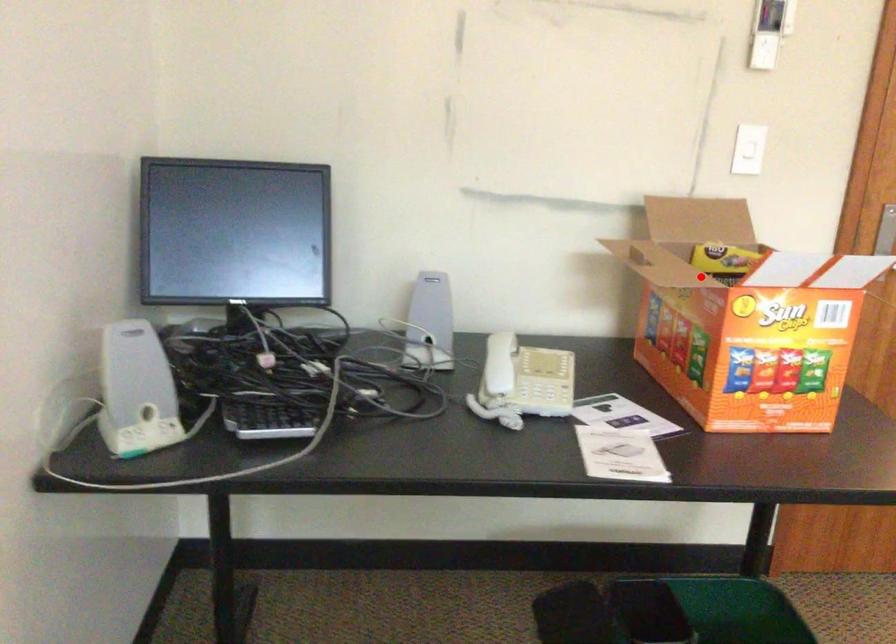
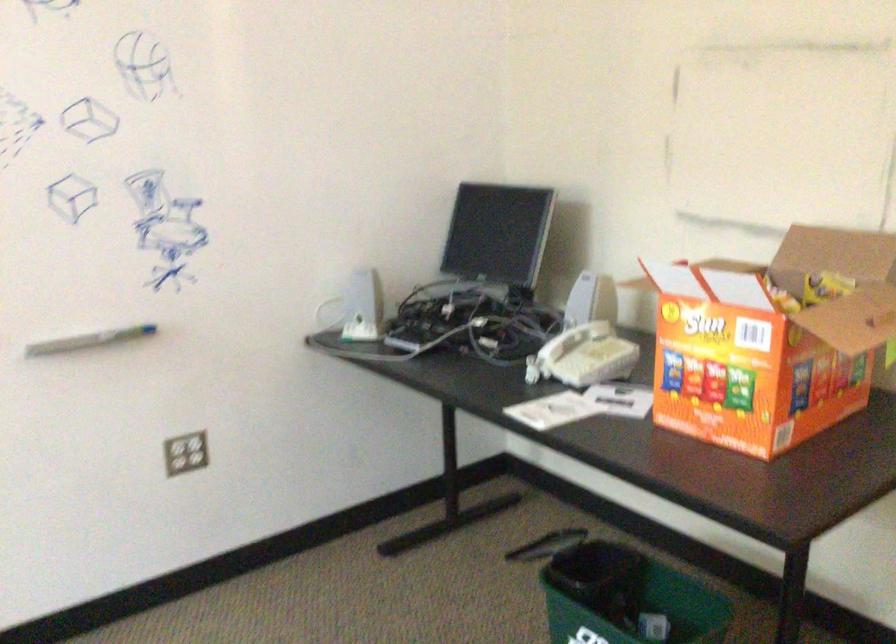
Question: I am providing you with two images of the same scene from different viewpoints. In image1, a red point is highlighted. Considering the same 3D point in image2, which of the following is correct?

Choices:
 (A) It is closer
 (B) It is farther

Answer: (B)